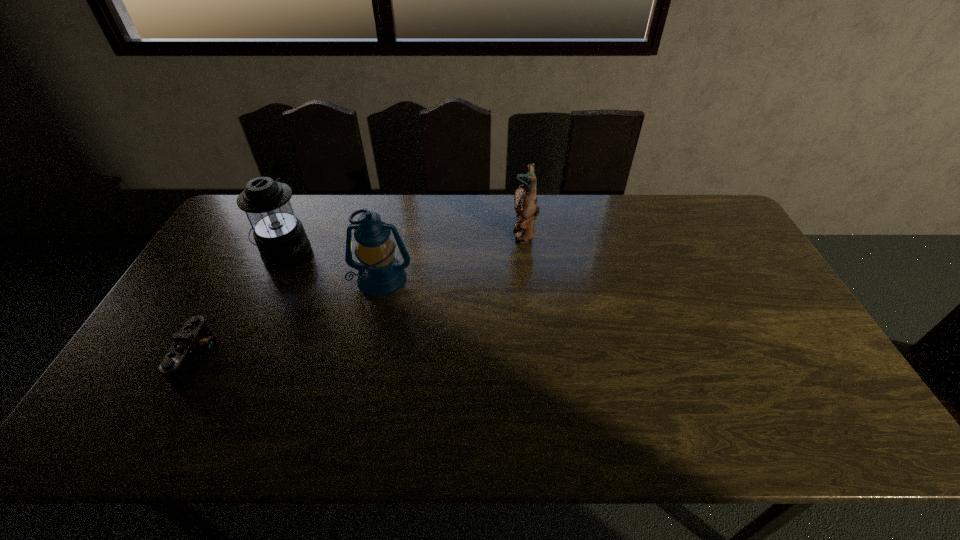
You are a GUI agent. You are given a task and a screenshot of the screen. Output one action in this format:
    pyautogui.click(x=<x>, y=<y>)
    Task: Click on the vacant region that satisfies the following two spatial constraints: 1. on the front-facing side of the figurine; 2. on the front side of the left lantern
    
    Given the screenshot: What is the action you would take?
    pyautogui.click(x=525, y=253)

Locate an element on the screen. free location that satisfies the following two spatial constraints: 1. on the front-facing side of the figurine; 2. on the face of the right lantern is located at coordinates (528, 279).